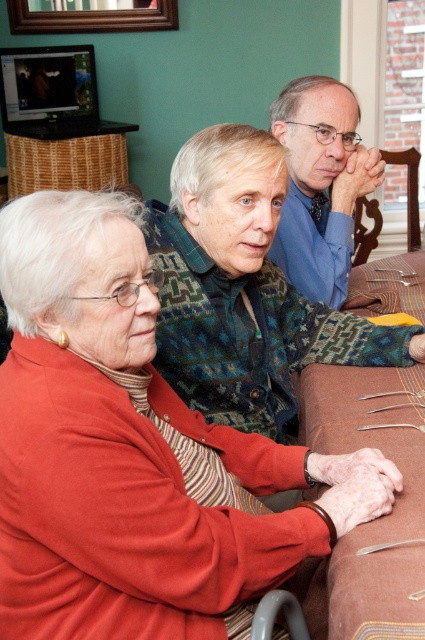
You are planning to place a new decorative item on the brown fabric table at center. However, you notice the matte red sweater at center is already occupying space there. Based on their sizes, can the decorative item be placed on the table without moving the sweater?

The matte red sweater at center is bigger than the brown fabric table at center. Since the sweater is larger, it may already be covering most of the table surface, leaving little to no space for the decorative item. Therefore, it is unlikely the item can be placed there without moving the sweater.

You are trying to decide which clothing item to take for a casual dinner date. Based on the image, which item is larger in size between the matte red sweater at center and the blue smooth shirt at upper center?

The matte red sweater at center is bigger than the blue smooth shirt at upper center, so you should choose the matte red sweater at center for a casual dinner date.